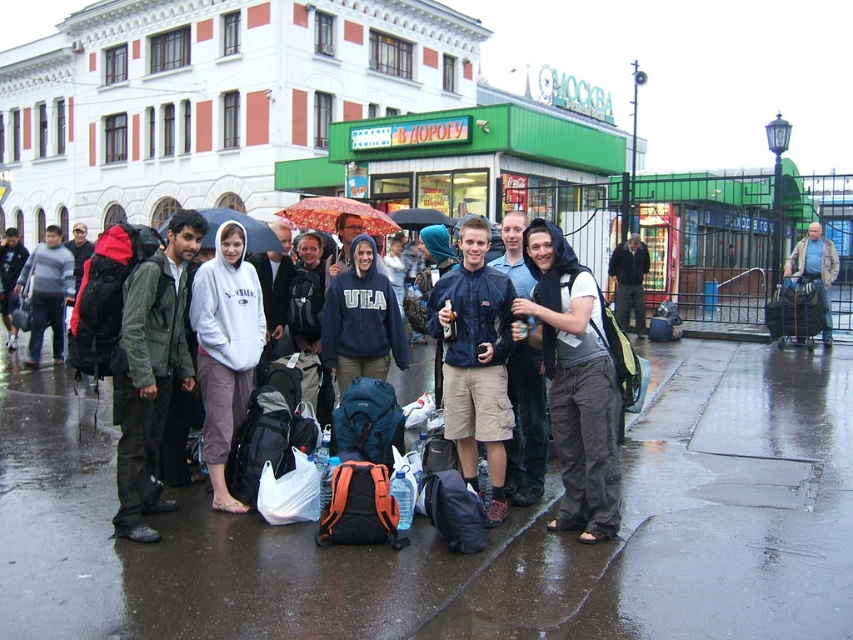
Question: Is gray fleece hoodie at center to the left of dark blue hoodie at center from the viewer's perspective?

Choices:
 (A) yes
 (B) no

Answer: (A)

Question: Which object is closer to the camera taking this photo?

Choices:
 (A) matte blue jacket at center
 (B) matte black backpack at center

Answer: (A)

Question: Can you confirm if gray fleece hoodie at center is positioned below dark blue hoodie at center?

Choices:
 (A) yes
 (B) no

Answer: (A)

Question: Can you confirm if dark gray cotton hoodie at center is smaller than matte black backpack at center?

Choices:
 (A) yes
 (B) no

Answer: (B)

Question: Among these points, which one is farthest from the camera?

Choices:
 (A) (605, 333)
 (B) (326, 228)
 (C) (86, 547)

Answer: (B)

Question: Which point is farther to the camera?

Choices:
 (A) denim jacket at right
 (B) dark blue hoodie at center
 (C) wet asphalt pavement at lower center

Answer: (B)